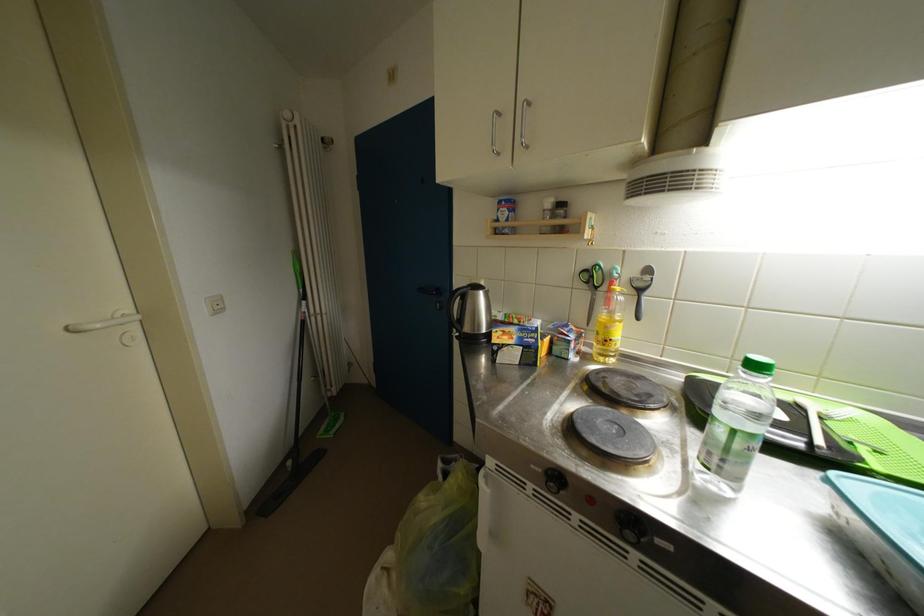
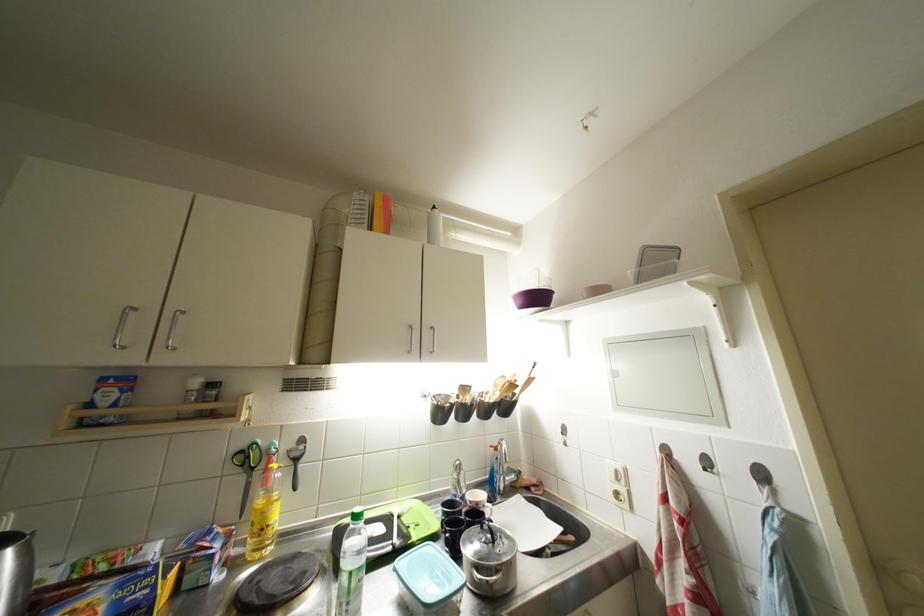
Where in the second image is the point corresponding to [593,270] from the first image?

(249, 450)